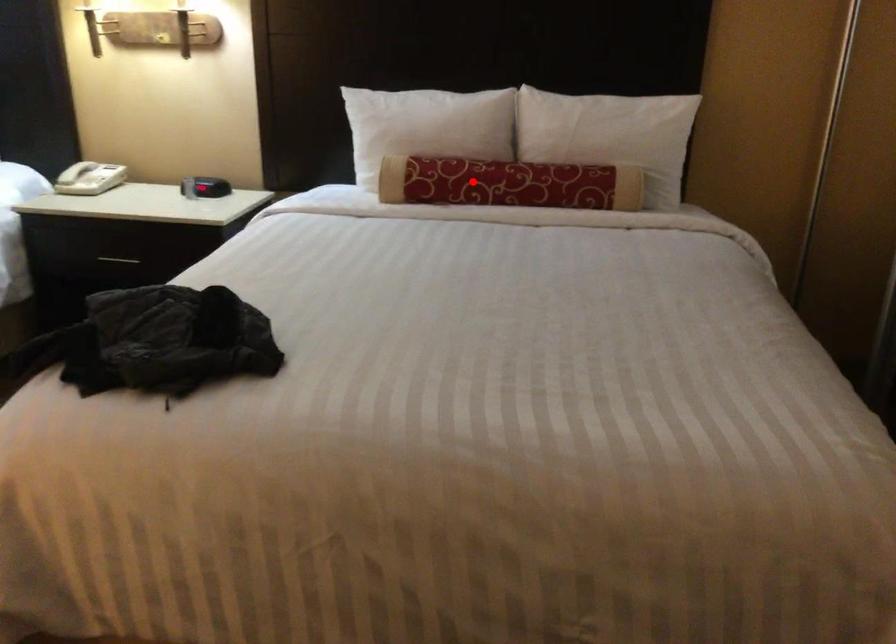
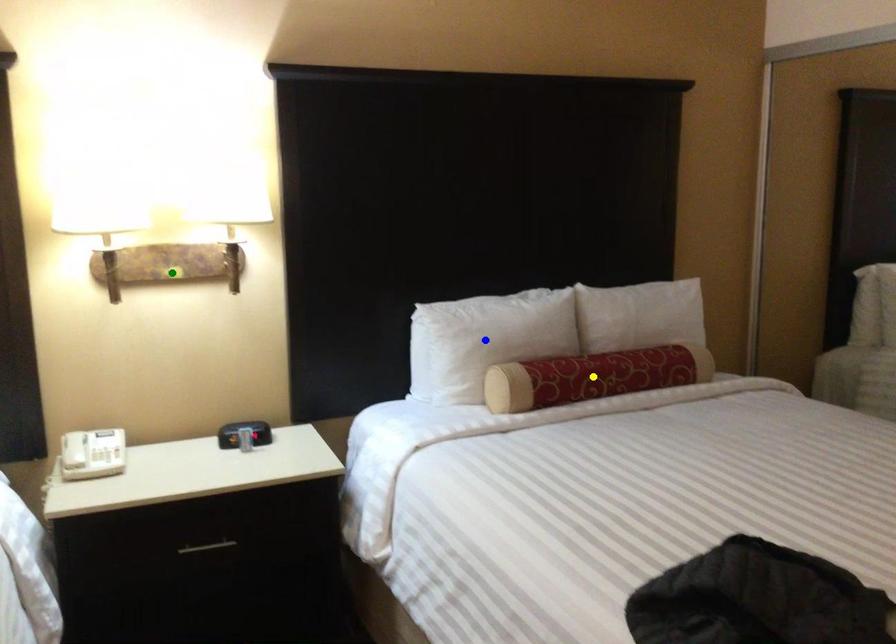
Question: I am providing you with two images of the same scene from different viewpoints. A red point is marked on the first image. You are given multiple points on the second image. Can you choose the point in image 2 that corresponds to the point in image 1?

Choices:
 (A) green point
 (B) yellow point
 (C) blue point

Answer: (B)